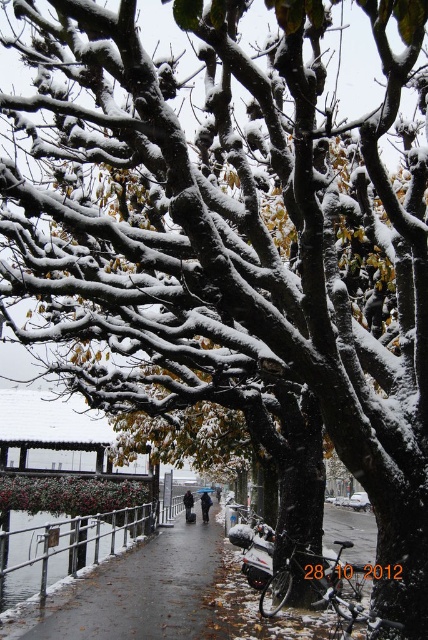
Question: Is concrete sidewalk at center thinner than dark blue jacket at center?

Choices:
 (A) no
 (B) yes

Answer: (A)

Question: Which point appears closest to the camera in this image?

Choices:
 (A) (207, 504)
 (B) (71, 582)
 (C) (184, 496)

Answer: (B)

Question: Which point is closer to the camera?

Choices:
 (A) concrete sidewalk at center
 (B) dark blue jacket at center
 (C) dark gray jacket at center

Answer: (A)

Question: Considering the relative positions of concrete sidewalk at center and dark blue jacket at center in the image provided, where is concrete sidewalk at center located with respect to dark blue jacket at center?

Choices:
 (A) above
 (B) below

Answer: (A)

Question: Among these points, which one is farthest from the camera?

Choices:
 (A) (211, 502)
 (B) (184, 500)

Answer: (A)

Question: Does concrete sidewalk at center come behind dark gray jacket at center?

Choices:
 (A) yes
 (B) no

Answer: (B)